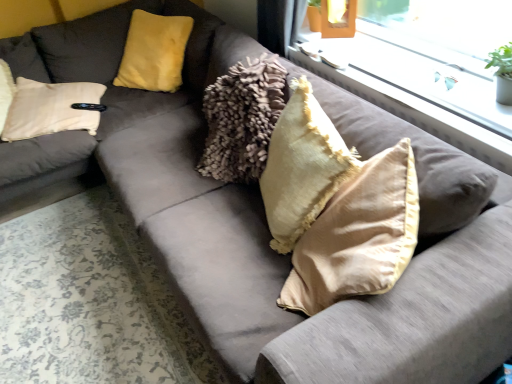
Question: Can you confirm if velvet yellow pillow at upper left, which appears as the first pillow when viewed from the back, is bigger than satin beige pillow at center, the 3th pillow positioned from the back?

Choices:
 (A) yes
 (B) no

Answer: (B)

Question: Considering the relative positions of velvet yellow pillow at upper left, which appears as the first pillow when viewed from the back, and satin beige pillow at center, the first pillow in the right-to-left sequence, in the image provided, is velvet yellow pillow at upper left, which appears as the first pillow when viewed from the back, to the right of satin beige pillow at center, the first pillow in the right-to-left sequence, from the viewer's perspective?

Choices:
 (A) no
 (B) yes

Answer: (A)

Question: Does velvet yellow pillow at upper left, the 1th pillow viewed from the left, come behind satin beige pillow at center, the third pillow in the left-to-right sequence?

Choices:
 (A) yes
 (B) no

Answer: (A)

Question: Is there a large distance between velvet yellow pillow at upper left, which appears as the third pillow when viewed from the right, and satin beige pillow at center, the third pillow in the left-to-right sequence?

Choices:
 (A) no
 (B) yes

Answer: (B)

Question: From the image's perspective, is velvet yellow pillow at upper left, which is counted as the third pillow, starting from the front, above satin beige pillow at center, the third pillow in the left-to-right sequence?

Choices:
 (A) no
 (B) yes

Answer: (B)

Question: Does point (324, 301) appear closer or farther from the camera than point (333, 129)?

Choices:
 (A) farther
 (B) closer

Answer: (B)

Question: From the image's perspective, is satin beige pillow at center, the first pillow in the right-to-left sequence, above or below beige velvet pillow at center, the second pillow viewed from the back?

Choices:
 (A) above
 (B) below

Answer: (B)

Question: Do you think satin beige pillow at center, the 3th pillow positioned from the back, is within beige velvet pillow at center, the second pillow viewed from the back, or outside of it?

Choices:
 (A) inside
 (B) outside

Answer: (B)

Question: Considering the relative positions of satin beige pillow at center, the 1th pillow in the front-to-back sequence, and beige velvet pillow at center, the 2th pillow viewed from the right, in the image provided, is satin beige pillow at center, the 1th pillow in the front-to-back sequence, to the left or to the right of beige velvet pillow at center, the 2th pillow viewed from the right,?

Choices:
 (A) left
 (B) right

Answer: (B)

Question: From the image's perspective, relative to clear glass window at upper center, is satin beige pillow at center, the 3th pillow positioned from the back, above or below?

Choices:
 (A) below
 (B) above

Answer: (A)

Question: Considering the positions of satin beige pillow at center, the 1th pillow in the front-to-back sequence, and clear glass window at upper center in the image, is satin beige pillow at center, the 1th pillow in the front-to-back sequence, bigger or smaller than clear glass window at upper center?

Choices:
 (A) small
 (B) big

Answer: (B)

Question: Is satin beige pillow at center, the 1th pillow in the front-to-back sequence, wider or thinner than clear glass window at upper center?

Choices:
 (A) wide
 (B) thin

Answer: (A)

Question: Is satin beige pillow at center, the 3th pillow positioned from the back, taller or shorter than clear glass window at upper center?

Choices:
 (A) short
 (B) tall

Answer: (B)

Question: Would you say clear glass window at upper center is to the left or to the right of satin beige pillow at center, the first pillow in the right-to-left sequence, in the picture?

Choices:
 (A) right
 (B) left

Answer: (A)

Question: Is point (398, 31) positioned closer to the camera than point (395, 218)?

Choices:
 (A) closer
 (B) farther

Answer: (B)